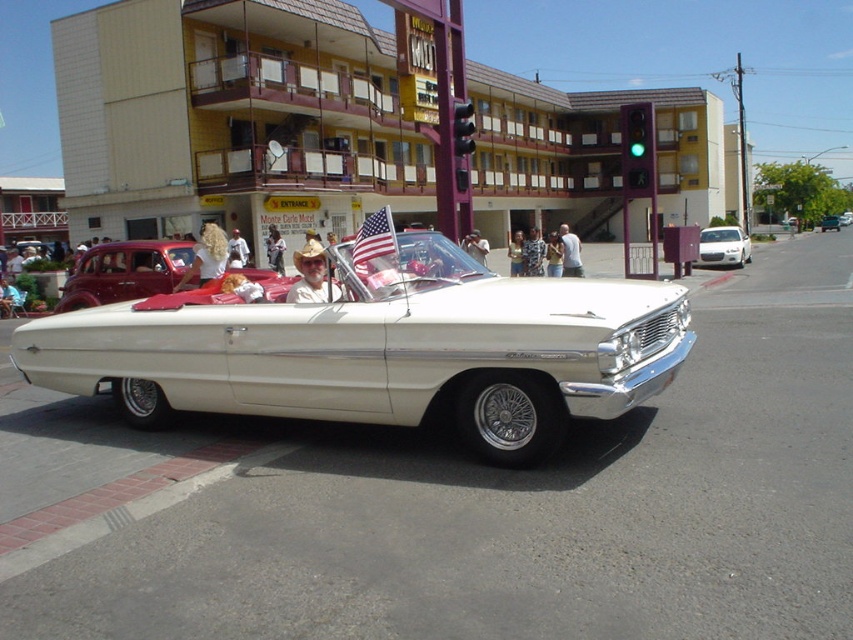
You are a pedestrian standing on the sidewalk observing the white metallic sedan at center and the american flag at center. Which object is positioned to the right of the other?

The white metallic sedan at center is to the right of the american flag at center.

You are standing at the point labeled point (383, 349) in the image. What object are you directly facing?

You are directly facing the white metallic convertible at center.